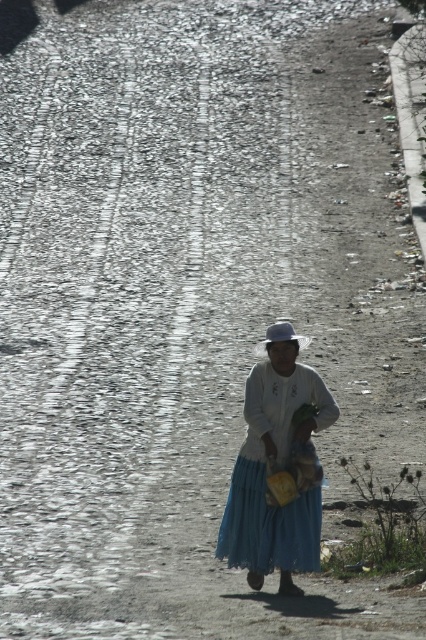
Question: Which of the following is the farthest from the observer?

Choices:
 (A) (301, 342)
 (B) (264, 400)

Answer: (B)

Question: Does white cotton dress at center have a larger size compared to natural straw hat at center?

Choices:
 (A) no
 (B) yes

Answer: (A)

Question: Can you confirm if white cotton dress at center is wider than natural straw hat at center?

Choices:
 (A) no
 (B) yes

Answer: (B)

Question: Is white cotton dress at center positioned in front of natural straw hat at center?

Choices:
 (A) no
 (B) yes

Answer: (B)